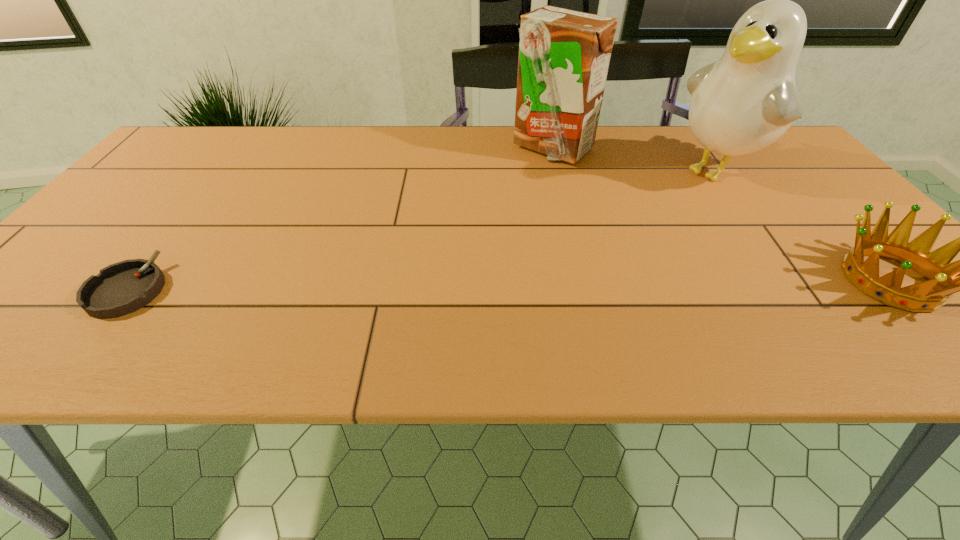
I want to click on vacant space on the desktop that is between the leftmost object and the crown and is positioned on the straw side of the second tallest object, so click(x=609, y=284).

Identify the location of vacant spot on the desktop that is between the ashtray and the crown and is positioned on the beak of the tallest object. click(525, 285).